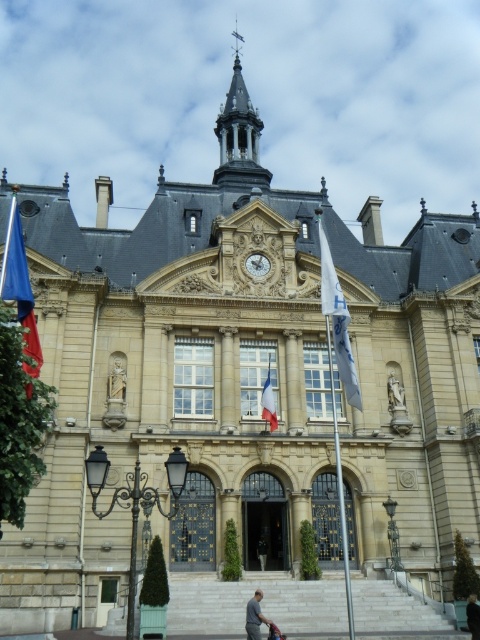
You are standing in front of the historic building and want to determine the relative positions of two points marked on the facade. Which point is closer to you, point 1 at coordinates (387, 380) or point 2 at (262, 554)?

Point 1 at coordinates (387, 380) is closer to you because it is further to the viewer than point 2 at (262, 554).

You are an architect visiting this historic building and notice the gold metallic clock at center and the dark blue fabric at center. Which object appears bigger in the image?

The gold metallic clock at center is larger in size than the dark blue fabric at center, so the gold metallic clock at center appears bigger in the image.

You are standing in front of the grand historic building and see the white marble statue at center and the dark gray fabric at center. Which object is positioned to the right side from your perspective?

The white marble statue at center is to the right of the dark gray fabric at center, so the white marble statue at center is positioned to the right side.